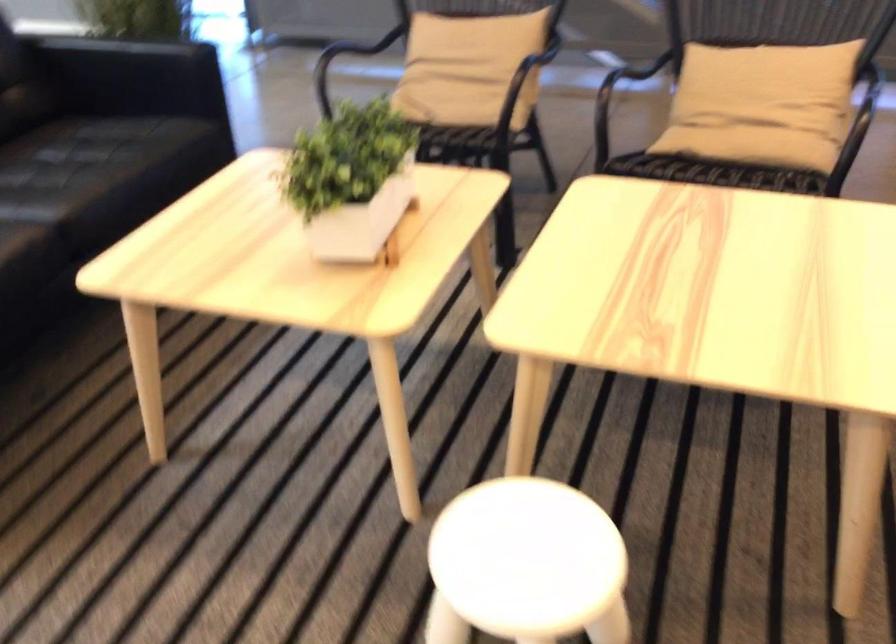
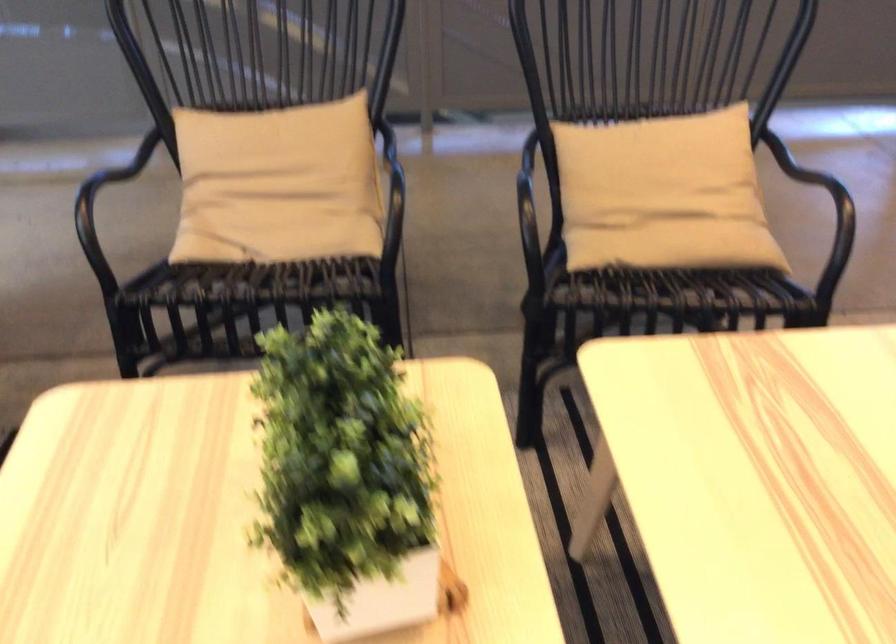
Locate, in the second image, the point that corresponds to (x=754, y=100) in the first image.

(662, 194)